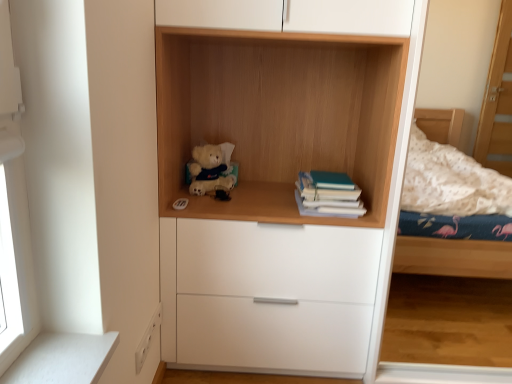
Locate an element on the screen. This screenshot has height=384, width=512. free space to the left of teal matte book at right is located at coordinates (260, 200).